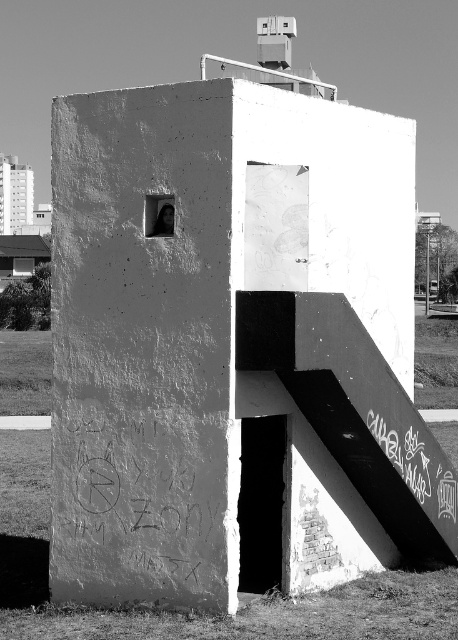
Does dark gray stone graffiti at center come in front of matte black skateboard at upper center?

Yes, it is in front of matte black skateboard at upper center.

Is point (54, 464) farther from camera compared to point (167, 211)?

Yes.

I want to click on dark gray stone graffiti at center, so click(x=138, y=499).

Is dark gray stone graffiti at center wider than graffiti chalk at lower right?

No.

Is dark gray stone graffiti at center closer to the viewer compared to graffiti chalk at lower right?

Yes, it is.

Between point (99, 429) and point (427, 484), which one is positioned behind?

Positioned behind is point (427, 484).

Find the location of a particular element. The height and width of the screenshot is (640, 458). dark gray stone graffiti at center is located at coordinates (138, 499).

Which of these two, smooth concrete stair at lower right or matte black skateboard at upper center, stands taller?

smooth concrete stair at lower right is taller.

Looking at this image, is smooth concrete stair at lower right to the right of matte black skateboard at upper center from the viewer's perspective?

Yes, smooth concrete stair at lower right is to the right of matte black skateboard at upper center.

Between point (442, 548) and point (168, 236), which one is positioned in front?

Point (168, 236) is in front.

At what (x,y) coordinates should I click in order to perform the action: click on smooth concrete stair at lower right. Please return your answer as a coordinate pair (x, y). Looking at the image, I should click on (366, 467).